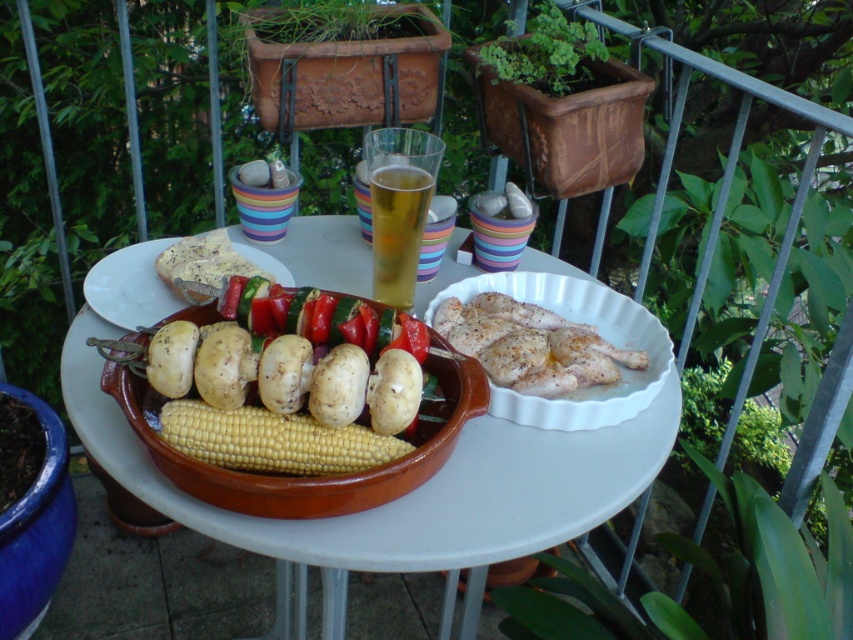
You are setting up a picnic and have a limited space. You need to place both the golden brown chicken at center and the white paper plate at center on your picnic basket. Which item should you place first to ensure both fit properly?

The golden brown chicken at center has a lesser width compared to the white paper plate at center. Therefore, you should place the white paper plate at center first to accommodate its larger size, then the golden brown chicken at center will fit alongside it.

You are planning to place a decorative plate between the yellow matte corn at center and the brown ceramic dish with skewers. The plate is 12 inches in diameter. Will there be enough space between them to fit the plate without overlapping?

The distance between the yellow matte corn at center and the brown ceramic dish with skewers is 27.93 inches. Since the plate is only 12 inches in diameter, there is sufficient space to place it between them without overlapping.